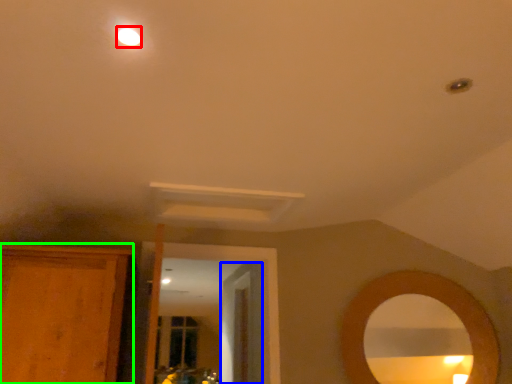
Question: Which object is positioned farthest from lighting (highlighted by a red box)? Select from door (highlighted by a blue box) and cabinetry (highlighted by a green box).

Choices:
 (A) door
 (B) cabinetry

Answer: (A)